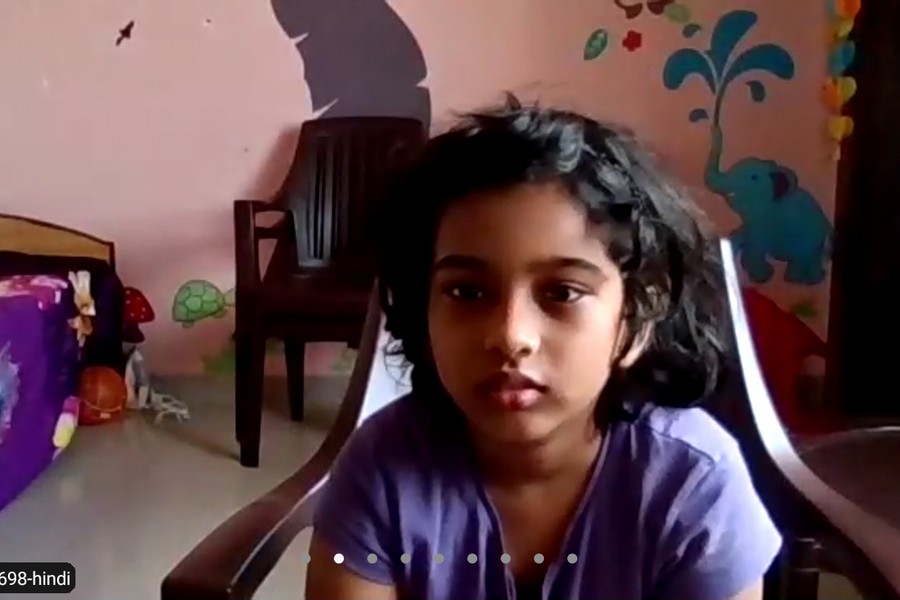
Locate an element on the screen. The image size is (900, 600). light gray floor color is located at coordinates (154, 523).